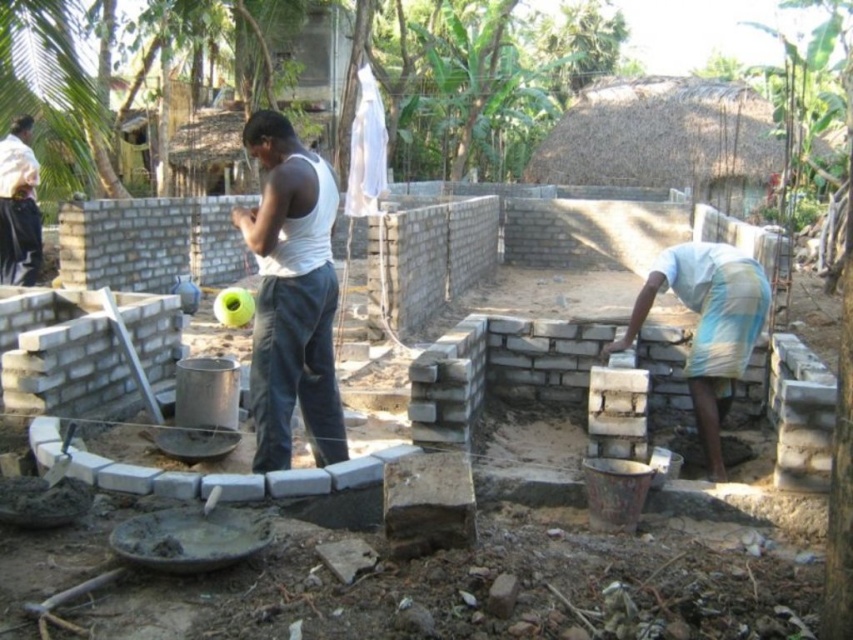
You are a construction worker observing the scene. You need to hand a tool to the person wearing the white matte tank top at center and the light blue plaid shorts at lower right. Since you are standing at the center, which person is closer to your left side?

The white matte tank top at center is to the left of light blue plaid shorts at lower right, so the person wearing the white matte tank top at center is closer to your left side.